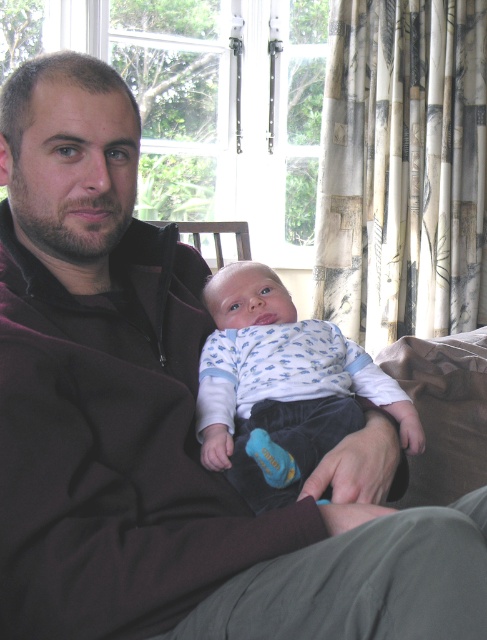
Based on the scene description, where is the white cotton onesie at center located in terms of its 2D coordinates?

The white cotton onesie at center is located at the 2D coordinates point (280,387).

You are a photographer setting up for a family photo shoot. You need to ensure the white cotton onesie at center and the wooden armchair at center are both in frame. Given that the camera lens has a maximum width capacity of 1.2 meters, can both objects fit side by side within the frame?

The white cotton onesie at center is wider than the wooden armchair at center. However, without knowing the exact widths of both objects, it is impossible to determine if their combined width exceeds the camera lens capacity of 1.2 meters. Additional measurements are needed.